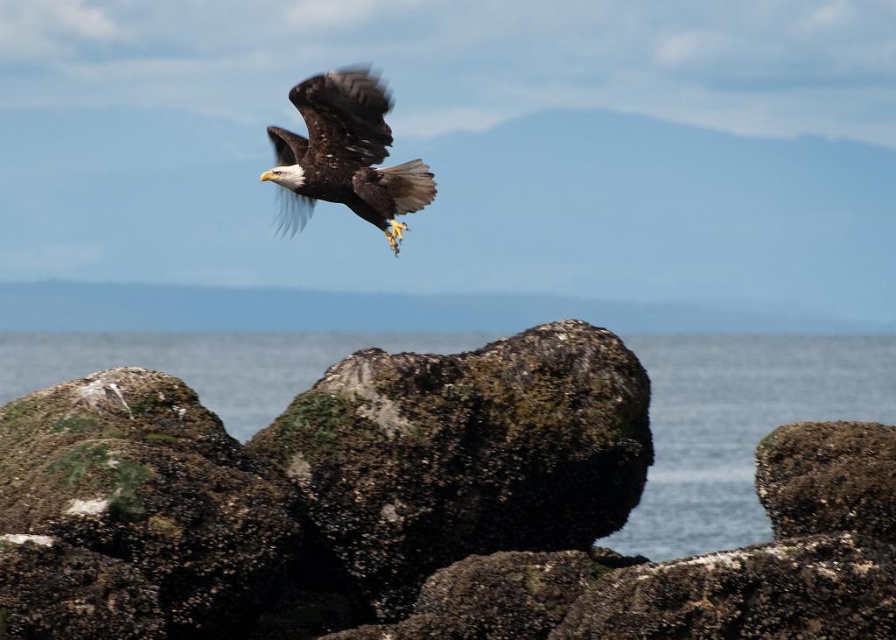
Between mossy rock at center and brown feathered eagle at upper center, which one appears on the right side from the viewer's perspective?

From the viewer's perspective, mossy rock at center appears more on the right side.

Measure the distance between point (x=550, y=547) and camera.

They are 89.55 feet apart.

At what (x,y) coordinates should I click in order to perform the action: click on mossy rock at center. Please return your answer as a coordinate pair (x, y). Looking at the image, I should click on (461, 456).

Can you confirm if mossy rock at center is positioned above transparent water at center?

Correct, mossy rock at center is located above transparent water at center.

Describe the element at coordinates (461, 456) in the screenshot. The height and width of the screenshot is (640, 896). I see `mossy rock at center` at that location.

Locate an element on the screen. This screenshot has width=896, height=640. mossy rock at center is located at coordinates (461, 456).

Does transparent water at center have a larger size compared to brown feathered eagle at upper center?

Indeed, transparent water at center has a larger size compared to brown feathered eagle at upper center.

Who is more forward, (739, 340) or (299, 140)?

Positioned in front is point (299, 140).

Which is behind, point (739, 396) or point (316, 145)?

Point (739, 396)

Where is `transparent water at center`? The height and width of the screenshot is (640, 896). transparent water at center is located at coordinates (738, 426).